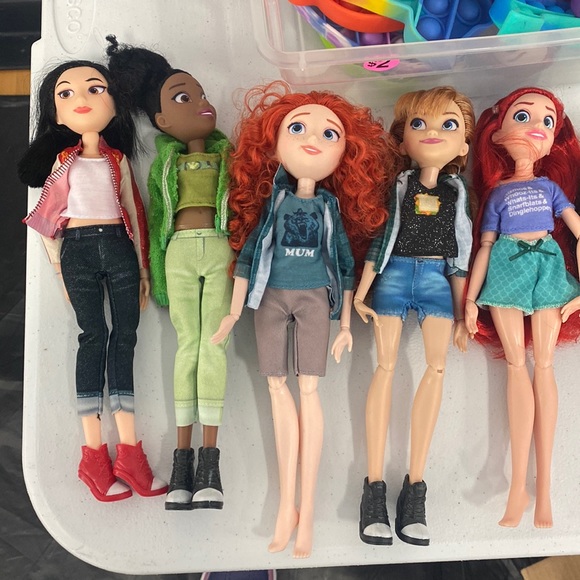
Image resolution: width=580 pixels, height=580 pixels. I want to click on dolls, so click(x=311, y=337).